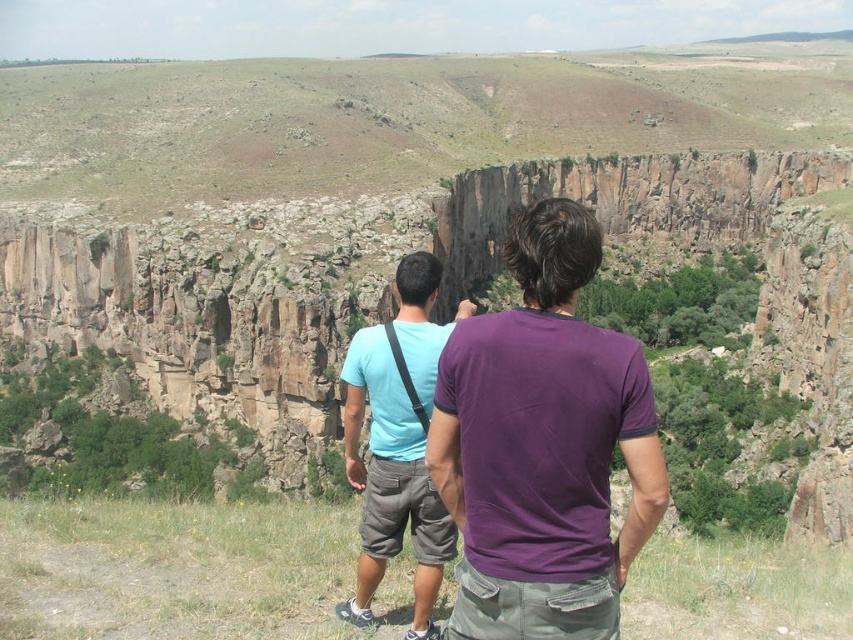
Question: Is purple cotton shirt at center positioned in front of light blue t-shirt at center?

Choices:
 (A) yes
 (B) no

Answer: (A)

Question: Is purple cotton shirt at center positioned at the back of light blue t-shirt at center?

Choices:
 (A) yes
 (B) no

Answer: (B)

Question: Which object appears farthest from the camera in this image?

Choices:
 (A) light blue t-shirt at center
 (B) purple cotton shirt at center

Answer: (A)

Question: Is the position of purple cotton shirt at center more distant than that of light blue t-shirt at center?

Choices:
 (A) no
 (B) yes

Answer: (A)